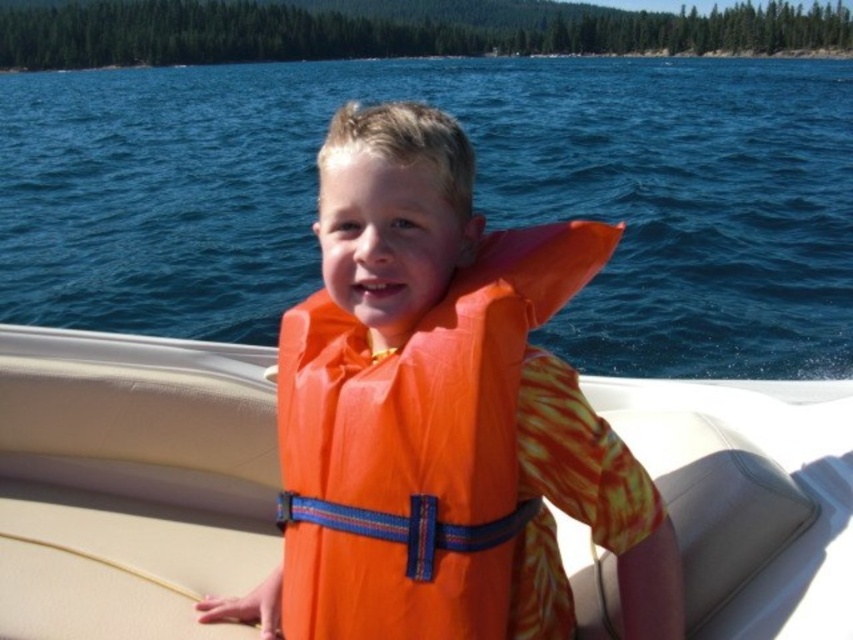
You are a lifeguard and need to choose between the orange rubber life vest at center and the orange fabric life vest at center for a child. Which one is wider?

The orange rubber life vest at center is wider than the orange fabric life vest at center according to the description.

You are a lifeguard checking the equipment. You see the orange life vest at center and the orange rubber life vest at center. Which one is larger in size?

The orange life vest at center is bigger than the orange rubber life vest at center.

In the scene shown: You are a lifeguard on duty and notice two orange life vests at the center of the scene. Which one is closer to you, the orange rubber life vest at center or the orange fabric life vest at center?

The orange rubber life vest at center is closer to you because it is in front of the orange fabric life vest at center.